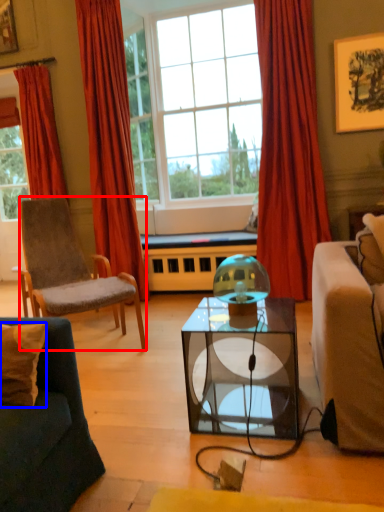
Question: Which object is closer to the camera taking this photo, chair (highlighted by a red box) or pillow (highlighted by a blue box)?

Choices:
 (A) chair
 (B) pillow

Answer: (B)